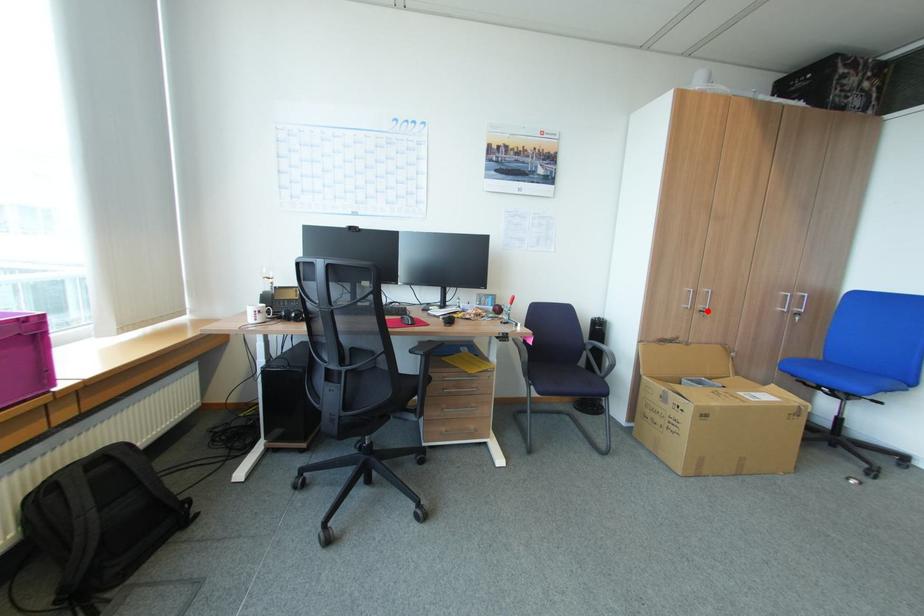
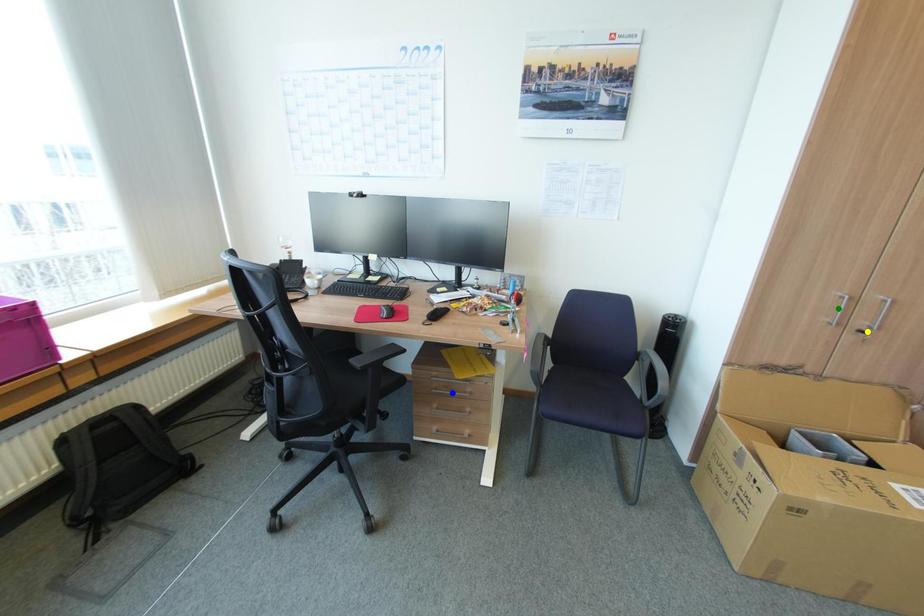
Question: I am providing you with two images of the same scene from different viewpoints. A red point is marked on the first image. You are given multiple points on the second image. Which mark in image 2 goes with the point in image 1?

Choices:
 (A) yellow point
 (B) blue point
 (C) green point

Answer: (A)